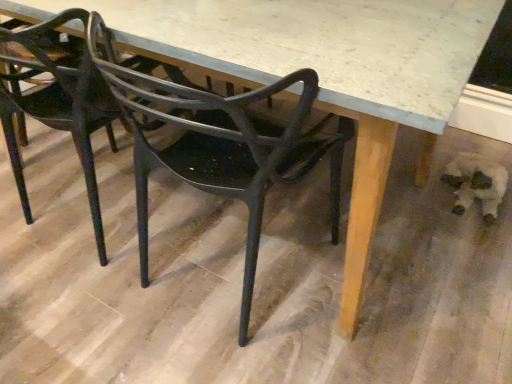
Locate an element on the screen. This screenshot has width=512, height=384. free space to the left of fuzzy white dog at lower right is located at coordinates (415, 189).